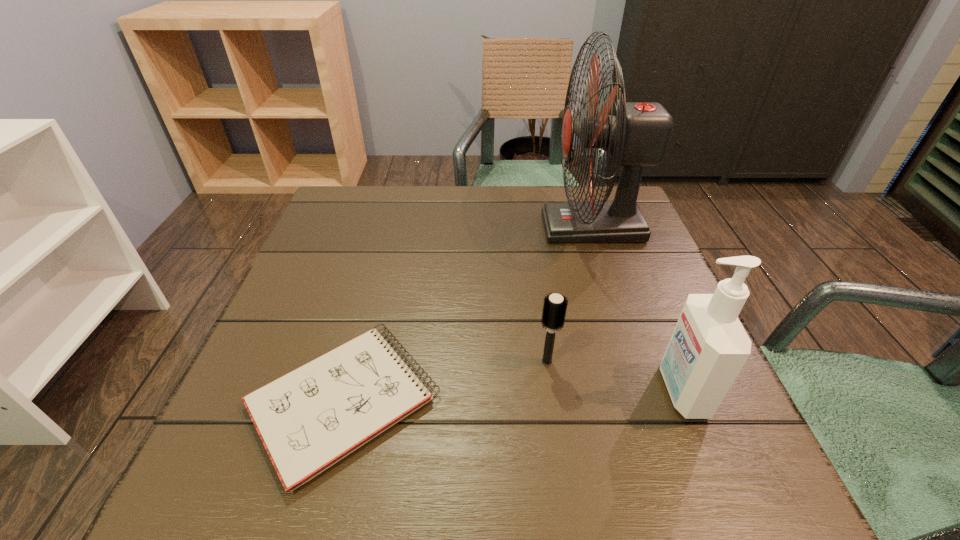
Where is `free location located 0.150m on the front label of the third shortest object`? free location located 0.150m on the front label of the third shortest object is located at coordinates (573, 390).

Where is `vacant area located on the front label of the third shortest object`? This screenshot has height=540, width=960. vacant area located on the front label of the third shortest object is located at coordinates (585, 390).

This screenshot has height=540, width=960. In order to click on vacant area situated 0.070m on the front label of the third shortest object in this screenshot , I will do `click(620, 390)`.

This screenshot has width=960, height=540. Identify the location of vacant space situated 0.120m on the back of the third object from right to left. (540, 307).

I want to click on vacant region located 0.050m on the right of the leftmost object, so click(469, 402).

Locate an element on the screen. This screenshot has width=960, height=540. object at the far edge is located at coordinates (636, 134).

Find the location of a particular element. This screenshot has width=960, height=540. object that is positioned at the near edge is located at coordinates (309, 419).

Find the location of a particular element. object that is at the left edge is located at coordinates [309, 419].

Where is `fan that is positioned at the right edge`? The height and width of the screenshot is (540, 960). fan that is positioned at the right edge is located at coordinates (636, 134).

The image size is (960, 540). I want to click on cleansing agent at the right edge, so click(x=709, y=346).